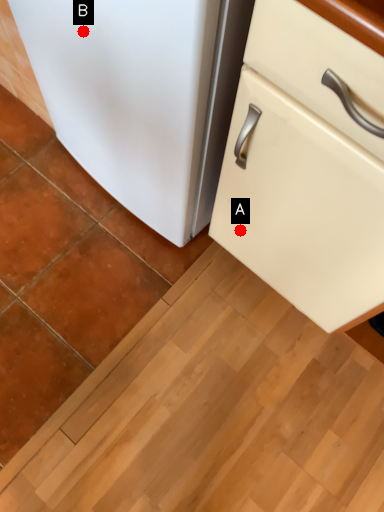
Question: Two points are circled on the image, labeled by A and B beside each circle. Which point is farther to the camera?

Choices:
 (A) A is further
 (B) B is further

Answer: (A)